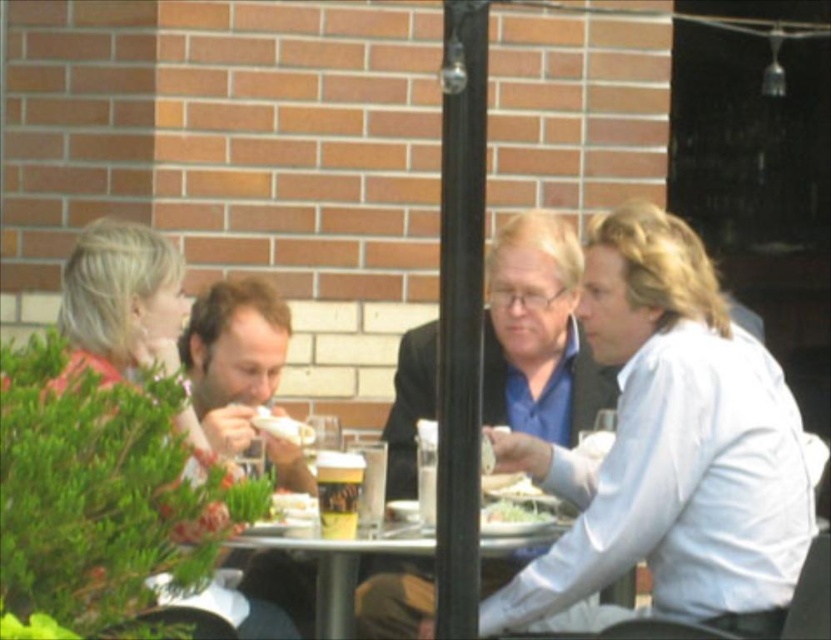
You are a waiter at the outdoor table and want to reach the white paper sandwich at center without moving the translucent plastic cup at center. Is this possible?

The translucent plastic cup at center is in front of the white paper sandwich at center, so you can reach the white paper sandwich at center by moving around the cup or from the sides, but you cannot directly access it without moving the cup first.

You are a photographer standing behind the group at the round table. You want to take a photo of the brown hair at center and the white paper plate at center. Which object will appear larger in the photo?

The brown hair at center will appear larger in the photo because it is taller than the white paper plate at center.